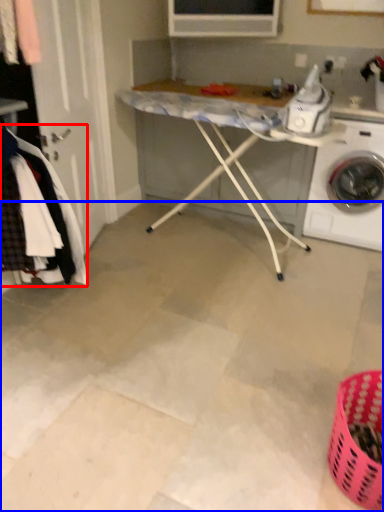
Question: Which object is closer to the camera taking this photo, clothing (highlighted by a red box) or concrete (highlighted by a blue box)?

Choices:
 (A) clothing
 (B) concrete

Answer: (B)